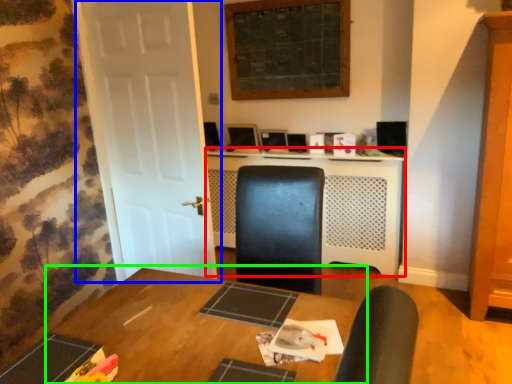
Question: Considering the real-world distances, which object is farthest from computer desk (highlighted by a red box)? door (highlighted by a blue box) or table (highlighted by a green box)?

Choices:
 (A) door
 (B) table

Answer: (B)